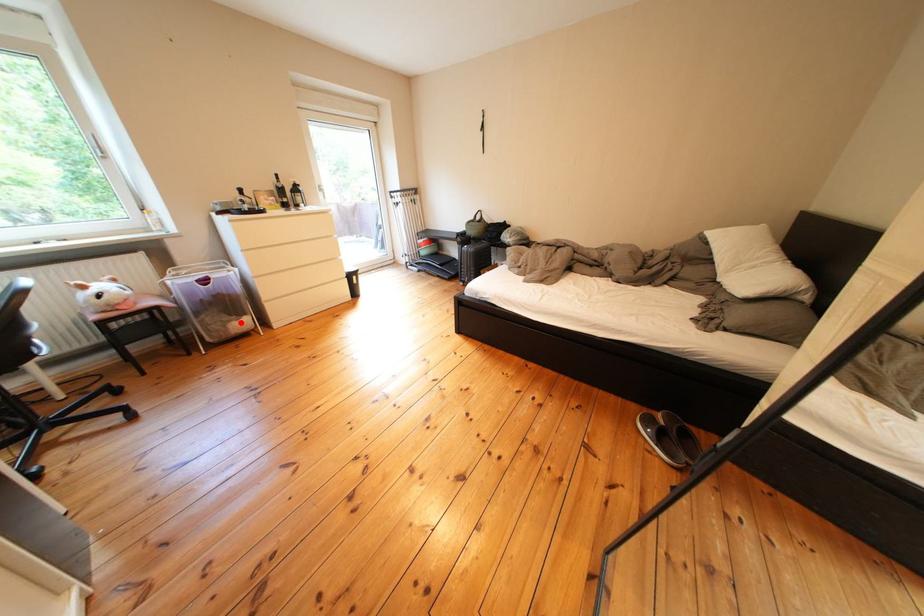
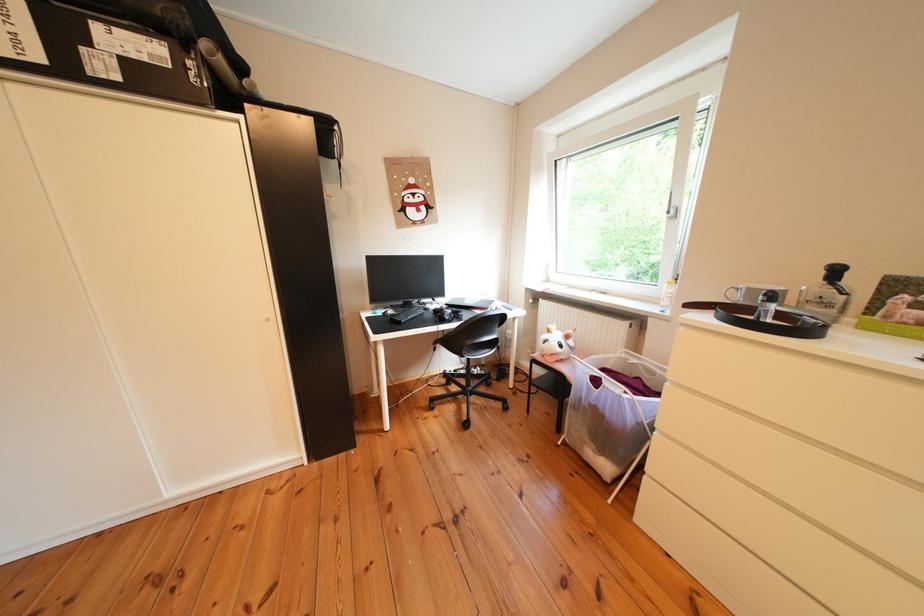
Locate, in the second image, the point that corresponds to the highlighted location in the first image.

(601, 442)